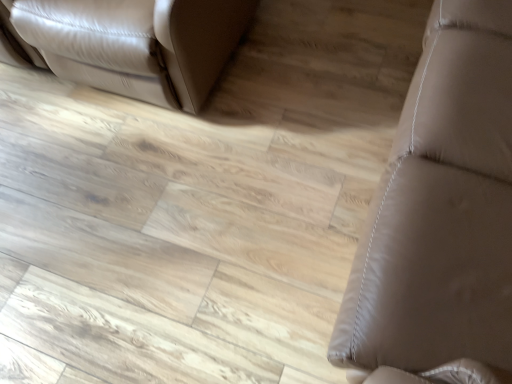
Find the location of a particular element. unoccupied region to the right of matte leather couch at upper left, the first furniture in the left-to-right sequence is located at coordinates (331, 60).